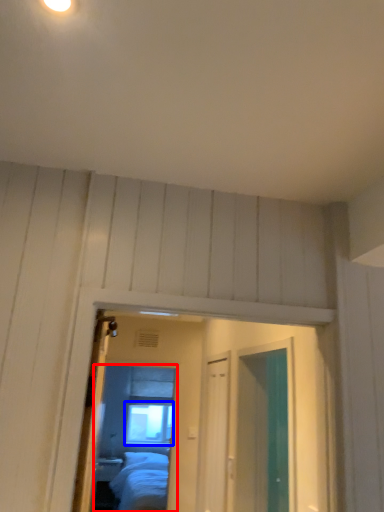
Question: Which object is further to the camera taking this photo, mirror (highlighted by a red box) or window (highlighted by a blue box)?

Choices:
 (A) mirror
 (B) window

Answer: (B)